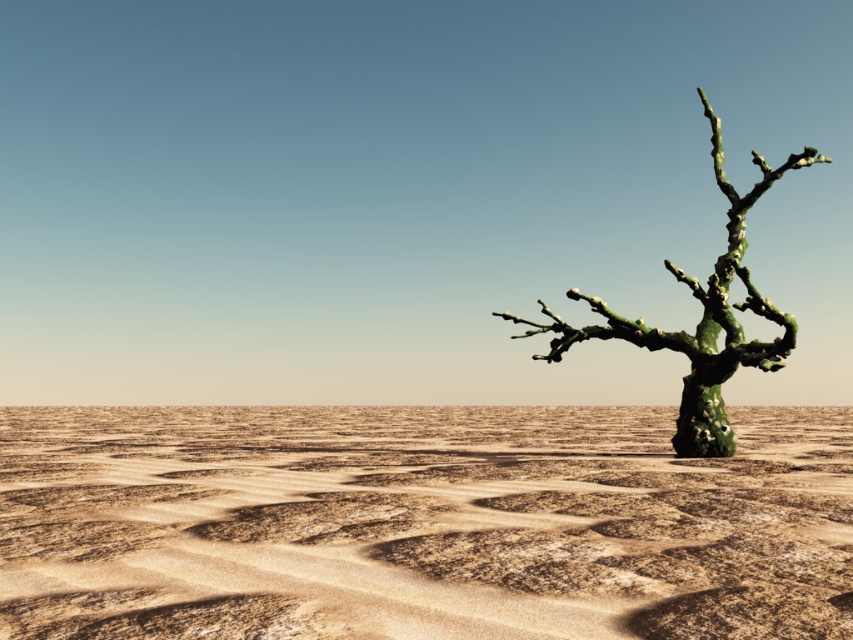
You are a hiker who wants to place a marker exactly at the center of the image. Given the coordinates provided, where should you place the marker relative to the brown textured sand at center?

The brown textured sand at center is located at coordinates point (421, 524), so the marker should be placed at the center of the image, which is at point (426, 320). Therefore, the marker should be placed to the left and slightly below the brown textured sand at center.

You are standing at the point marked by coordinates point (421, 524). Looking around, what do you see immediately around you?

The point (421, 524) marks brown textured sand at center, so you are standing on brown textured sand at center.